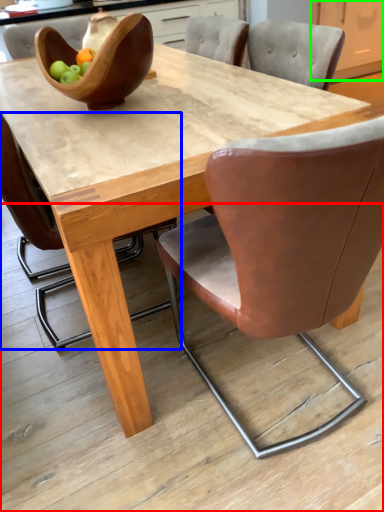
Question: Considering the real-world distances, which object is farthest from concrete (highlighted by a red box)? chair (highlighted by a blue box) or cabinetry (highlighted by a green box)?

Choices:
 (A) chair
 (B) cabinetry

Answer: (B)